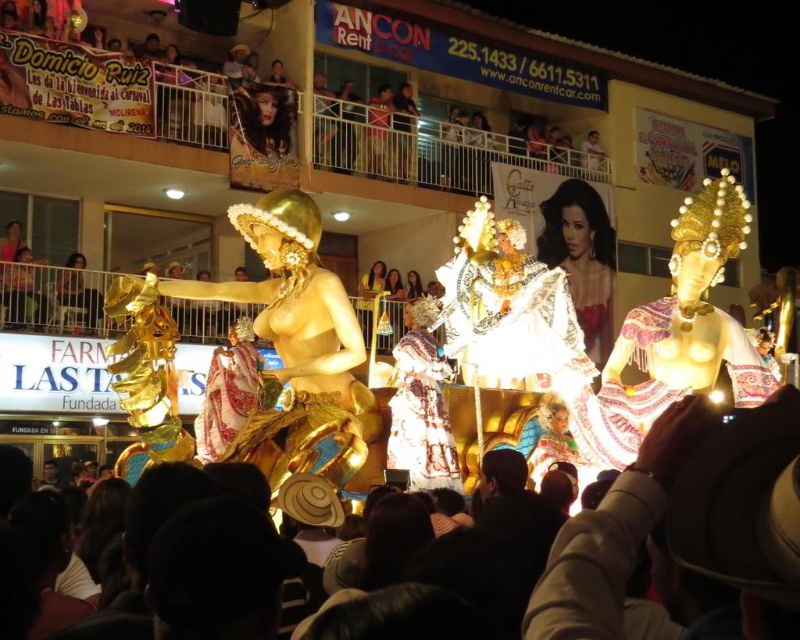
What do you see at coordinates (658, 380) in the screenshot? This screenshot has height=640, width=800. I see `embroidered silk dress at center` at bounding box center [658, 380].

Is point (633, 330) in front of point (432, 353)?

No, it is behind (432, 353).

Is point (692, 392) positioned before point (440, 404)?

No.

What are the coordinates of `embroidered silk dress at center` in the screenshot? It's located at (658, 380).

Who is more distant from viewer, (470, 298) or (228, 371)?

Positioned behind is point (470, 298).

Who is more distant from viewer, (526, 340) or (206, 426)?

Positioned behind is point (526, 340).

This screenshot has width=800, height=640. What are the coordinates of `white lace dress at center` in the screenshot? It's located at (512, 324).

Is dark brown leather hat at lower center thinner than embroidered fabric dress at center?

No, dark brown leather hat at lower center is not thinner than embroidered fabric dress at center.

Is dark brown leather hat at lower center wider than embroidered fabric dress at center?

Yes, dark brown leather hat at lower center is wider than embroidered fabric dress at center.

This screenshot has height=640, width=800. In order to click on dark brown leather hat at lower center in this screenshot , I will do `click(688, 522)`.